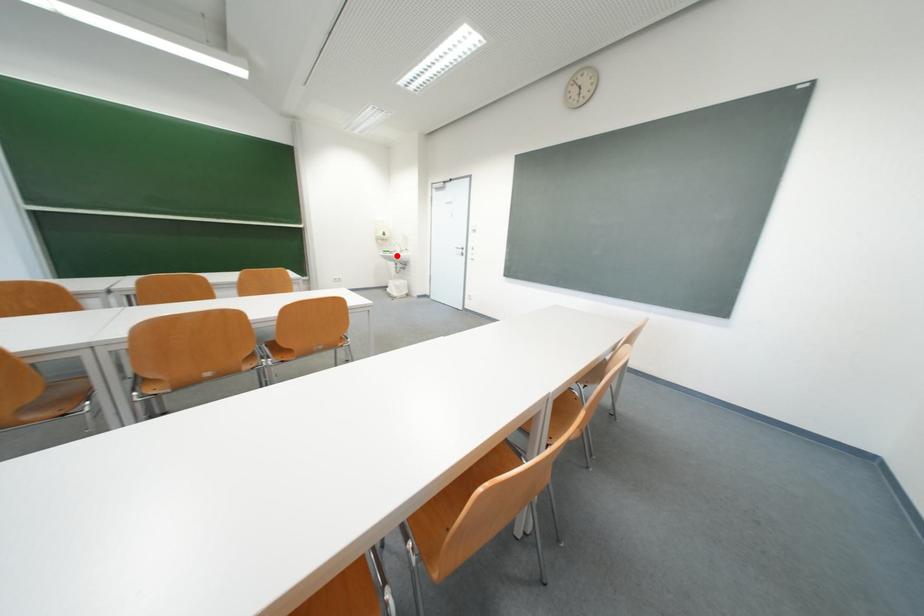
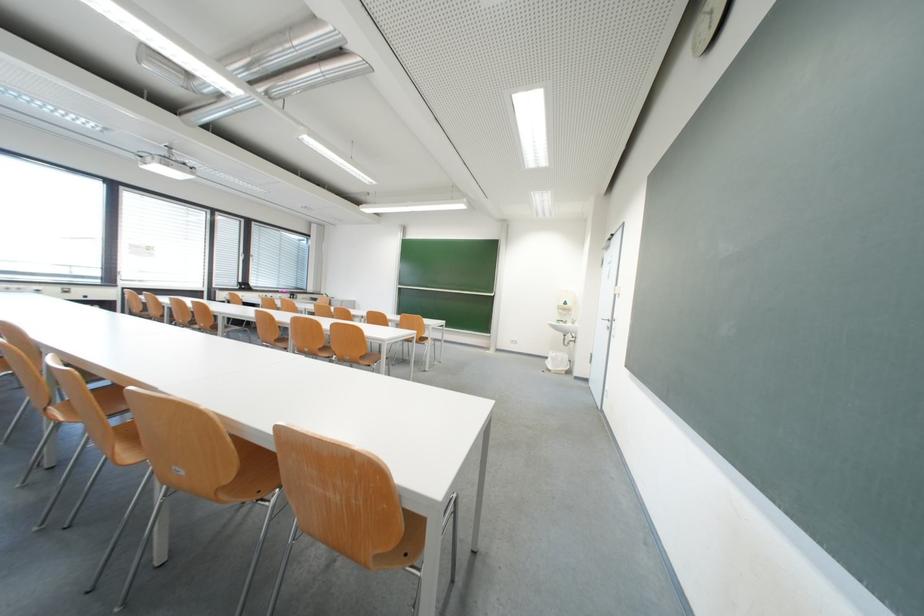
Question: I am providing you with two images of the same scene from different viewpoints. In image1, a red point is highlighted. Considering the same 3D point in image2, which of the following is correct?

Choices:
 (A) It is closer
 (B) It is farther

Answer: (B)